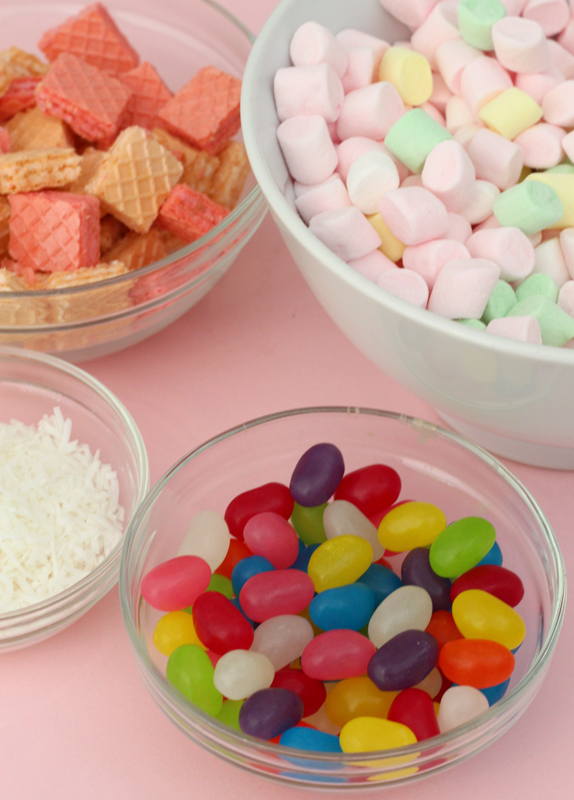
The width and height of the screenshot is (574, 800). Identify the location of white bowl. (471, 378).